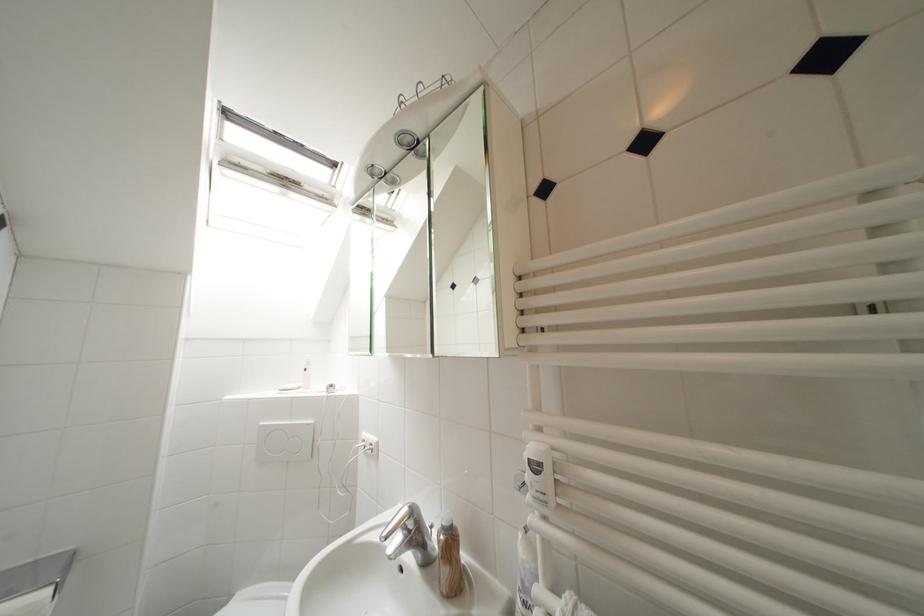
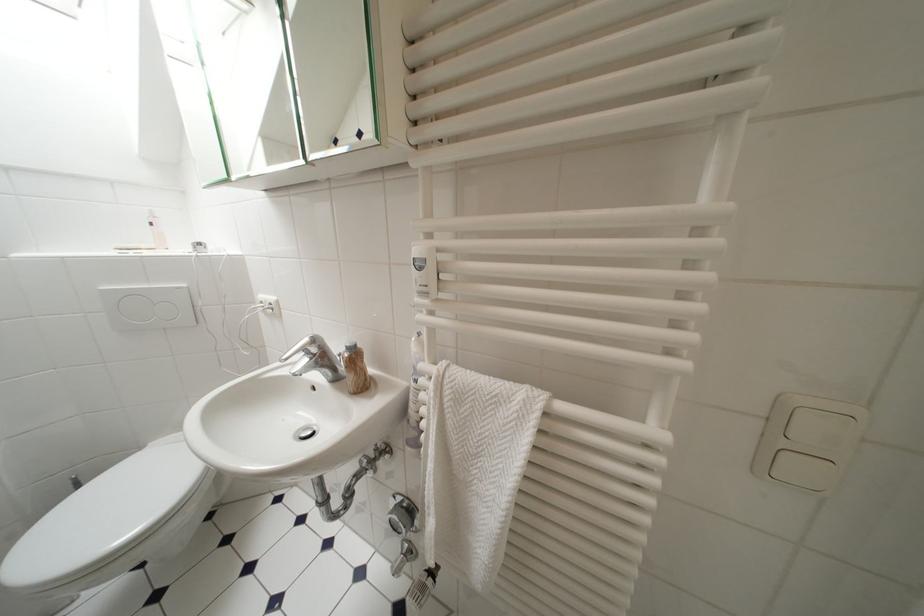
Find the pixel in the second image that matches [419,515] in the first image.

(322, 342)